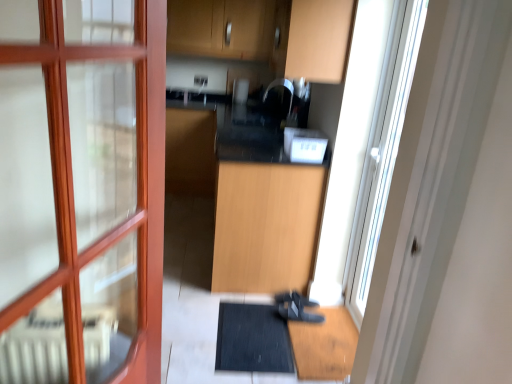
What do you see at coordinates (252, 339) in the screenshot?
I see `black rubber bath mat at lower center` at bounding box center [252, 339].

What do you see at coordinates (430, 182) in the screenshot? This screenshot has width=512, height=384. I see `transparent glass screen door at right` at bounding box center [430, 182].

Image resolution: width=512 pixels, height=384 pixels. What are the coordinates of `wooden cabinet at upper center, acting as the first cabinetry starting from the top` in the screenshot? It's located at (318, 40).

What do you see at coordinates (304, 145) in the screenshot? The height and width of the screenshot is (384, 512). I see `white plastic toaster at center` at bounding box center [304, 145].

Locate an element on the screen. The image size is (512, 384). black rubber bath mat at lower center is located at coordinates (252, 339).

Considering the sizes of objects white plastic toaster at center and light wood cabinet at center, the first cabinetry when ordered from bottom to top, in the image provided, who is thinner, white plastic toaster at center or light wood cabinet at center, the first cabinetry when ordered from bottom to top,?

Thinner between the two is white plastic toaster at center.

Which of these two, white plastic toaster at center or light wood cabinet at center, the first cabinetry when ordered from bottom to top, is bigger?

Bigger between the two is light wood cabinet at center, the first cabinetry when ordered from bottom to top.

Which point is more distant from viewer, (285, 136) or (275, 173)?

The point (285, 136) is behind.

From a real-world perspective, which object rests below the other?

From a 3D spatial view, light wood cabinet at center, the first cabinetry when ordered from bottom to top, is below.

How many degrees apart are the facing directions of wooden cabinet at upper center, acting as the first cabinetry starting from the top, and white plastic toaster at center?

The angle between the facing direction of wooden cabinet at upper center, acting as the first cabinetry starting from the top, and the facing direction of white plastic toaster at center is 1 degrees.

Is wooden cabinet at upper center, acting as the first cabinetry starting from the top, in front of or behind white plastic toaster at center in the image?

In the image, wooden cabinet at upper center, acting as the first cabinetry starting from the top, appears in front of white plastic toaster at center.

Who is shorter, wooden cabinet at upper center, arranged as the second cabinetry when ordered from the bottom, or white plastic toaster at center?

Standing shorter between the two is white plastic toaster at center.

From the picture: Is wooden cabinet at upper center, acting as the first cabinetry starting from the top, completely or partially outside of white plastic toaster at center?

wooden cabinet at upper center, acting as the first cabinetry starting from the top, lies outside white plastic toaster at center's area.

Are light wood cabinet at center, the first cabinetry when ordered from bottom to top, and wooden cabinet at upper center, arranged as the second cabinetry when ordered from the bottom, making contact?

No, light wood cabinet at center, the first cabinetry when ordered from bottom to top, is not making contact with wooden cabinet at upper center, arranged as the second cabinetry when ordered from the bottom.

Does light wood cabinet at center, which is the second cabinetry from top to bottom, have a larger size compared to wooden cabinet at upper center, arranged as the second cabinetry when ordered from the bottom?

Correct, light wood cabinet at center, which is the second cabinetry from top to bottom, is larger in size than wooden cabinet at upper center, arranged as the second cabinetry when ordered from the bottom.

From a real-world perspective, between light wood cabinet at center, the first cabinetry when ordered from bottom to top, and wooden cabinet at upper center, acting as the first cabinetry starting from the top, who is vertically lower?

light wood cabinet at center, the first cabinetry when ordered from bottom to top, from a real-world perspective.

From a real-world perspective, relative to wooden cabinet at upper center, arranged as the second cabinetry when ordered from the bottom, is black rubber bath mat at lower center vertically above or below?

From a real-world perspective, black rubber bath mat at lower center is physically below wooden cabinet at upper center, arranged as the second cabinetry when ordered from the bottom.

From the image's perspective, relative to wooden cabinet at upper center, acting as the first cabinetry starting from the top, is black rubber bath mat at lower center above or below?

Clearly, from the image's perspective, black rubber bath mat at lower center is below wooden cabinet at upper center, acting as the first cabinetry starting from the top.

Can you tell me how much black rubber bath mat at lower center and wooden cabinet at upper center, arranged as the second cabinetry when ordered from the bottom, differ in facing direction?

black rubber bath mat at lower center and wooden cabinet at upper center, arranged as the second cabinetry when ordered from the bottom, are facing 86.9 degrees away from each other.

Find the location of `bath mat behind the wooden cabinet at upper center, arranged as the second cabinetry when ordered from the bottom`. bath mat behind the wooden cabinet at upper center, arranged as the second cabinetry when ordered from the bottom is located at coordinates (252, 339).

Is wooden cabinet at upper center, acting as the first cabinetry starting from the top, completely or partially outside of black rubber bath mat at lower center?

Yes, wooden cabinet at upper center, acting as the first cabinetry starting from the top, is outside of black rubber bath mat at lower center.

Is wooden cabinet at upper center, arranged as the second cabinetry when ordered from the bottom, facing towards black rubber bath mat at lower center?

No, wooden cabinet at upper center, arranged as the second cabinetry when ordered from the bottom, is not turned towards black rubber bath mat at lower center.

Measure the distance between black rubber bath mat at lower center and light wood cabinet at center, which is the second cabinetry from top to bottom.

black rubber bath mat at lower center and light wood cabinet at center, which is the second cabinetry from top to bottom, are 18.55 inches apart from each other.

From the image's perspective, does black rubber bath mat at lower center appear higher than light wood cabinet at center, which is the second cabinetry from top to bottom?

No, from the image's perspective, black rubber bath mat at lower center is not on top of light wood cabinet at center, which is the second cabinetry from top to bottom.

Is black rubber bath mat at lower center oriented away from light wood cabinet at center, the first cabinetry when ordered from bottom to top?

That's right, black rubber bath mat at lower center is facing away from light wood cabinet at center, the first cabinetry when ordered from bottom to top.

In the image, there is a white plastic toaster at center. What are the coordinates of `cabinetry below it (from the image's perspective)` in the screenshot? It's located at 266,226.

What's the angular difference between light wood cabinet at center, which is the second cabinetry from top to bottom, and white plastic toaster at center's facing directions?

The angle between the facing direction of light wood cabinet at center, which is the second cabinetry from top to bottom, and the facing direction of white plastic toaster at center is 1.91 degrees.

From a real-world perspective, is light wood cabinet at center, the first cabinetry when ordered from bottom to top, positioned over white plastic toaster at center based on gravity?

No, from a real-world perspective, light wood cabinet at center, the first cabinetry when ordered from bottom to top, is not on top of white plastic toaster at center.

Is light wood cabinet at center, the first cabinetry when ordered from bottom to top, wider than white plastic toaster at center?

Yes, light wood cabinet at center, the first cabinetry when ordered from bottom to top, is wider than white plastic toaster at center.

Where is `cabinetry that appears below the white plastic toaster at center (from the image's perspective)`? cabinetry that appears below the white plastic toaster at center (from the image's perspective) is located at coordinates (266, 226).

From the white plastic toaster at center, count the 1st cabinetry to the left and point to it. Please provide its 2D coordinates.

[(318, 40)]

Considering their positions, is transparent glass screen door at right positioned closer to black matte shoe at lower center than black rubber bath mat at lower center?

black rubber bath mat at lower center lies closer to black matte shoe at lower center than the other object.

Consider the image. Looking at the image, which one is located further to black rubber bath mat at lower center, transparent glass screen door at right or black matte shoe at lower center?

The object further to black rubber bath mat at lower center is transparent glass screen door at right.

When comparing their distances from light wood cabinet at center, which is the second cabinetry from top to bottom, does black rubber bath mat at lower center or wooden cabinet at upper center, acting as the first cabinetry starting from the top, seem further?

wooden cabinet at upper center, acting as the first cabinetry starting from the top, lies further to light wood cabinet at center, which is the second cabinetry from top to bottom, than the other object.

Considering their positions, is light wood cabinet at center, the first cabinetry when ordered from bottom to top, positioned further to wooden cabinet at upper center, acting as the first cabinetry starting from the top, than transparent glass screen door at right?

transparent glass screen door at right is positioned further to the anchor wooden cabinet at upper center, acting as the first cabinetry starting from the top.

Consider the image. Based on their spatial positions, is transparent glass screen door at right or wooden cabinet at upper center, acting as the first cabinetry starting from the top, closer to light wood cabinet at center, which is the second cabinetry from top to bottom?

Based on the image, wooden cabinet at upper center, acting as the first cabinetry starting from the top, appears to be nearer to light wood cabinet at center, which is the second cabinetry from top to bottom.

Based on their spatial positions, is white plastic toaster at center or wooden cabinet at upper center, acting as the first cabinetry starting from the top, closer to light wood cabinet at center, the first cabinetry when ordered from bottom to top?

white plastic toaster at center.

In the scene shown: Considering their positions, is transparent glass screen door at right positioned closer to black matte shoe at lower center than wooden cabinet at upper center, arranged as the second cabinetry when ordered from the bottom?

The object closer to black matte shoe at lower center is transparent glass screen door at right.

Estimate the real-world distances between objects in this image. Which object is closer to black matte shoe at lower center, wooden cabinet at upper center, arranged as the second cabinetry when ordered from the bottom, or white plastic toaster at center?

white plastic toaster at center is closer to black matte shoe at lower center.

Locate an element on the screen. cabinetry between transparent glass screen door at right and light wood cabinet at center, which is the second cabinetry from top to bottom, from front to back is located at coordinates (318, 40).

This screenshot has width=512, height=384. I want to click on appliance between transparent glass screen door at right and black matte shoe at lower center from front to back, so click(x=304, y=145).

Identify the location of shoe between light wood cabinet at center, the first cabinetry when ordered from bottom to top, and black rubber bath mat at lower center, in the vertical direction. (296, 307).

You are a GUI agent. You are given a task and a screenshot of the screen. Output one action in this format:
    pyautogui.click(x=<x>, y=<y>)
    Task: Click on the cabinetry between white plastic toaster at center and black matte shoe at lower center vertically
    Image resolution: width=512 pixels, height=384 pixels.
    Given the screenshot: What is the action you would take?
    pyautogui.click(x=266, y=226)